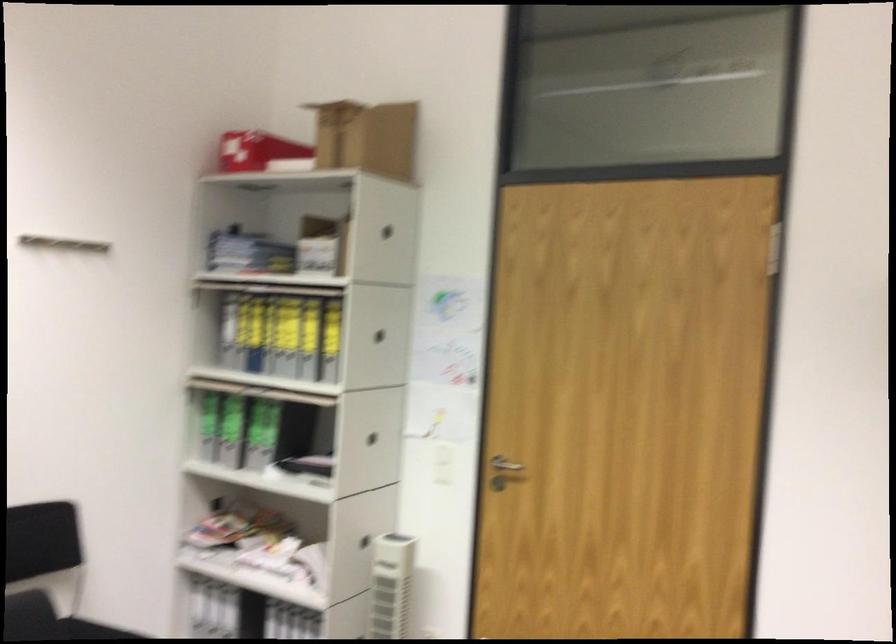
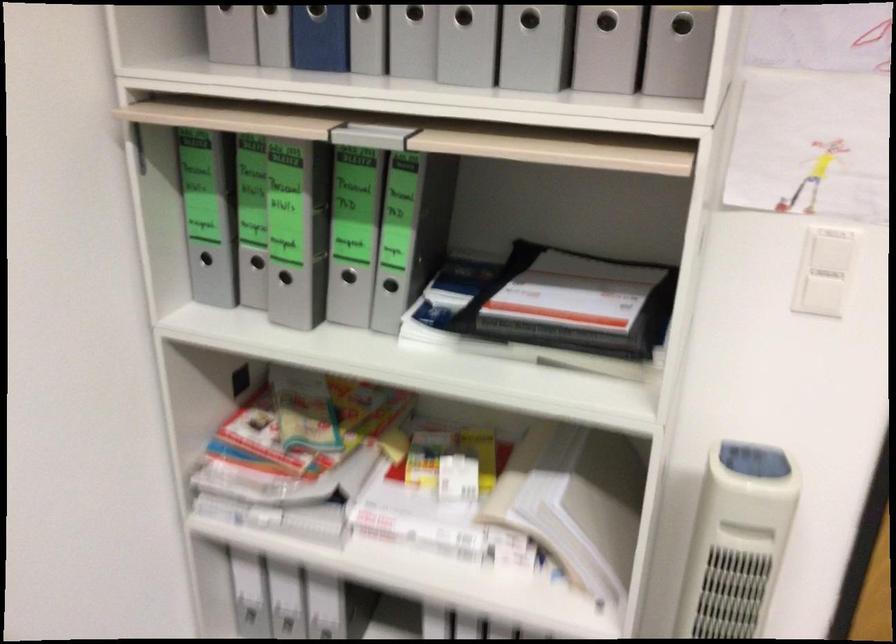
Locate, in the second image, the point that corresponds to the point at 453,471 in the first image.

(823, 295)